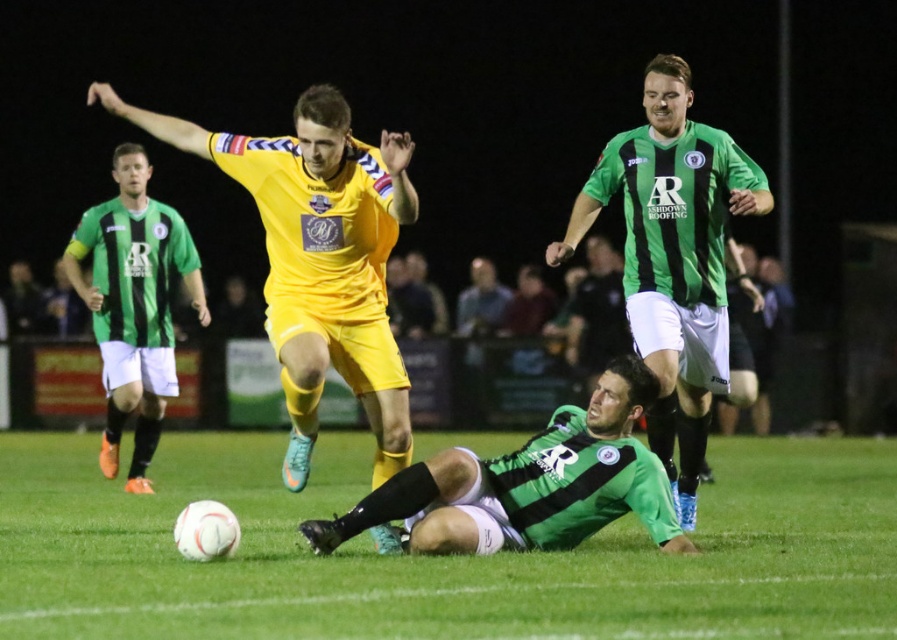
Question: Does green grass at center have a lesser width compared to green striped jersey at left?

Choices:
 (A) yes
 (B) no

Answer: (B)

Question: Based on their relative distances, which object is nearer to the green grass at center?

Choices:
 (A) green striped jersey at upper right
 (B) green striped jersey at left

Answer: (A)

Question: Which point is closer to the camera taking this photo?

Choices:
 (A) (475, 547)
 (B) (164, 508)
 (C) (634, 296)

Answer: (A)

Question: Is green grass at center above yellow matte/synthetic soccer player at center?

Choices:
 (A) yes
 (B) no

Answer: (B)

Question: Which of the following is the farthest from the observer?

Choices:
 (A) (843, 604)
 (B) (153, 339)
 (C) (678, 108)
 (D) (417, 536)

Answer: (B)

Question: Can you confirm if yellow matte/synthetic soccer player at center is bigger than green striped jersey at upper right?

Choices:
 (A) no
 (B) yes

Answer: (A)